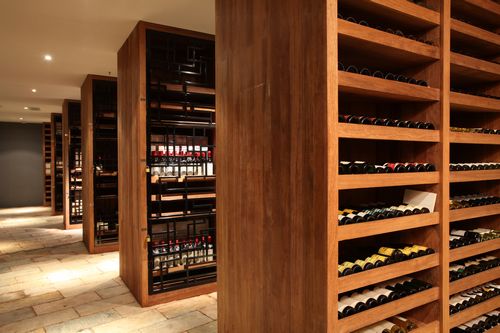
What are the coordinates of `shelving` in the screenshot? It's located at (50, 179), (58, 186), (72, 192), (99, 198), (158, 223), (258, 243).